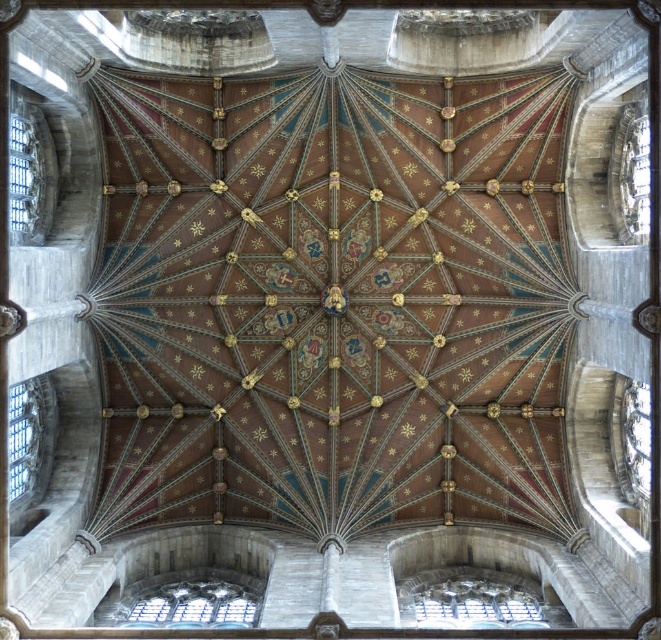
You are an architect examining the cathedral ceiling. You notice the clear glass window at lower left and the transparent glass window at left. Which window is positioned further back from your viewpoint?

The transparent glass window at left is positioned further back from your viewpoint because it is behind the clear glass window at lower left.

You are an architect examining the cathedral ceiling. You notice the transparent glass window at lower center and the clear glass window at lower left. Which of these two windows is bigger in size?

The transparent glass window at lower center is larger in size compared to the clear glass window at lower left.